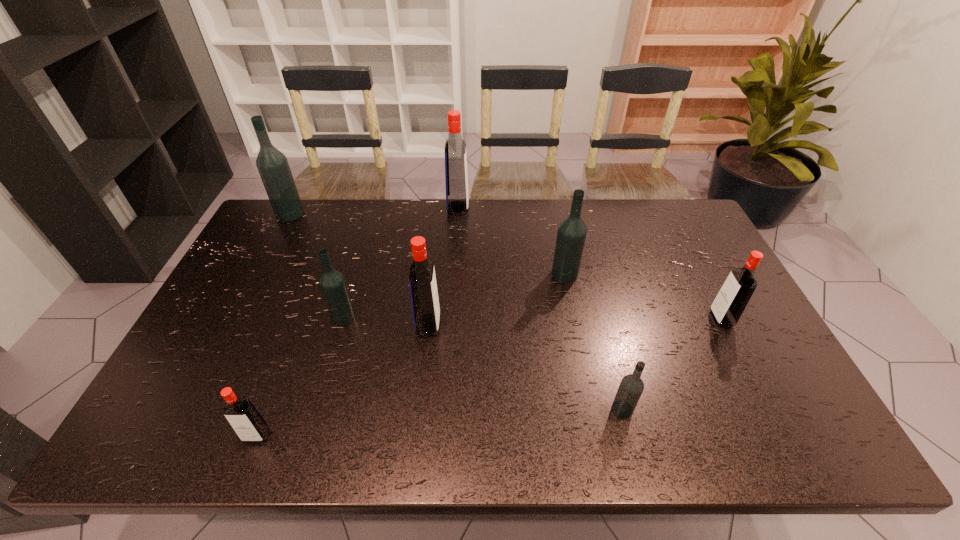
At what (x,y) coordinates should I click in order to perform the action: click on the farthest red vodka. Please return your answer as a coordinate pair (x, y). Looking at the image, I should click on [456, 178].

The width and height of the screenshot is (960, 540). What are the coordinates of `the leftmost vodka` in the screenshot? It's located at click(x=273, y=167).

This screenshot has height=540, width=960. I want to click on the farthest black vodka, so tap(273, 167).

Where is `the second biggest red vodka`? the second biggest red vodka is located at coordinates (423, 288).

The height and width of the screenshot is (540, 960). In order to click on the third object from right to left in this screenshot , I will do `click(571, 235)`.

You are a GUI agent. You are given a task and a screenshot of the screen. Output one action in this format:
    pyautogui.click(x=<x>, y=<y>)
    Task: Click on the sixth nearest vodka
    This screenshot has width=960, height=540.
    Given the screenshot: What is the action you would take?
    pyautogui.click(x=571, y=235)

Locate an element on the screen. This screenshot has width=960, height=540. the rightmost red vodka is located at coordinates (729, 304).

In order to click on the rightmost vodka in this screenshot , I will do `click(729, 304)`.

I want to click on the third farthest black vodka, so click(x=332, y=282).

Identify the location of the third black vodka from right to left. 332,282.